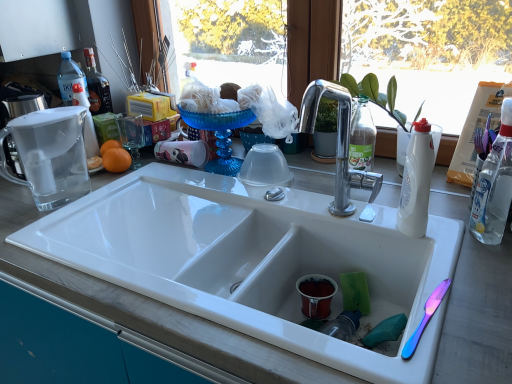
Find the location of a particular element. Image resolution: width=512 pixels, height=384 pixels. free point in front of clear glass pitcher at upper left is located at coordinates (57, 230).